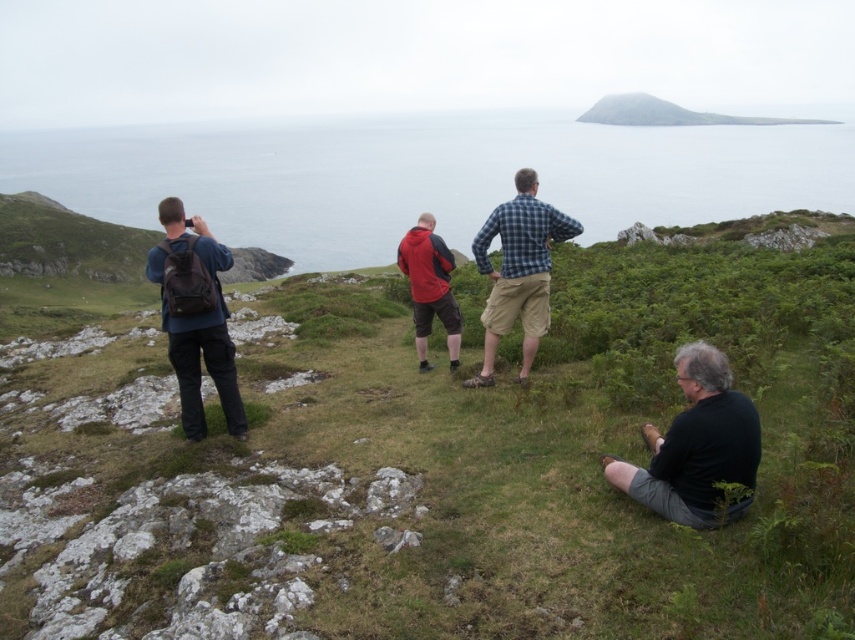
Question: Which object is the farthest from the plaid fabric shirt at center?

Choices:
 (A) green grassy at center
 (B) smooth gray rock at upper center
 (C) black matte shirt at lower right

Answer: (B)

Question: Can you confirm if green grassy at center is wider than smooth gray rock at upper center?

Choices:
 (A) no
 (B) yes

Answer: (A)

Question: Which of these objects is positioned closest to the matte black backpack at left?

Choices:
 (A) smooth gray rock at upper center
 (B) plaid fabric shirt at center
 (C) red matte jacket at center

Answer: (C)

Question: Can you confirm if green grassy at center is positioned above smooth gray rock at upper center?

Choices:
 (A) yes
 (B) no

Answer: (B)

Question: Which point is closer to the camera?

Choices:
 (A) (609, 104)
 (B) (705, 420)
 (C) (116, 161)
 (D) (272, 634)

Answer: (D)

Question: Considering the relative positions of blue water at center and plaid fabric shirt at center in the image provided, where is blue water at center located with respect to plaid fabric shirt at center?

Choices:
 (A) right
 (B) left

Answer: (A)